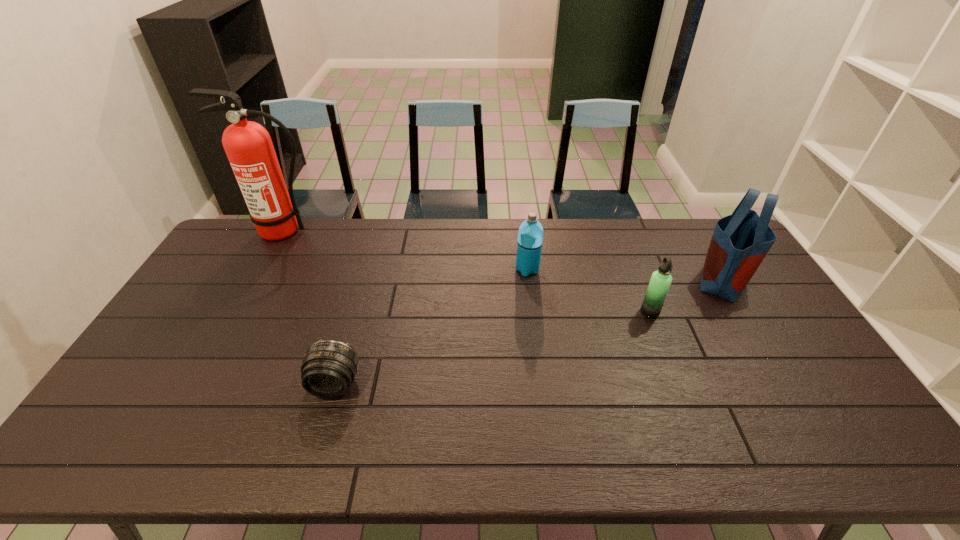
Where is `free point located on the handle side of the farthest object`? This screenshot has height=540, width=960. free point located on the handle side of the farthest object is located at coordinates (255, 283).

Locate an element on the screen. This screenshot has width=960, height=540. free space located on the front of the rightmost object is located at coordinates (757, 335).

Find the location of `vacant space located 0.200m on the front of the farther thermos bottle`. vacant space located 0.200m on the front of the farther thermos bottle is located at coordinates (534, 321).

You are a GUI agent. You are given a task and a screenshot of the screen. Output one action in this format:
    pyautogui.click(x=<x>, y=<y>)
    Task: Click on the vacant position located 0.150m on the front of the fourth object from left to right
    The image size is (960, 540).
    Given the screenshot: What is the action you would take?
    pyautogui.click(x=668, y=358)

At what (x,y) coordinates should I click in order to perform the action: click on vacant space located at the front element of the second object from left to right. Please return your answer as a coordinate pair (x, y). Image resolution: width=960 pixels, height=540 pixels. Looking at the image, I should click on pyautogui.click(x=325, y=420).

In order to click on fire extinguisher that is at the far edge in this screenshot , I will do `click(249, 148)`.

Locate an element on the screen. handbag that is at the far edge is located at coordinates (740, 242).

Identify the location of object that is at the left edge. (249, 148).

At what (x,y) coordinates should I click in order to perform the action: click on object at the right edge. Please return your answer as a coordinate pair (x, y). The height and width of the screenshot is (540, 960). Looking at the image, I should click on (740, 242).

Image resolution: width=960 pixels, height=540 pixels. I want to click on object that is at the far left corner, so click(x=249, y=148).